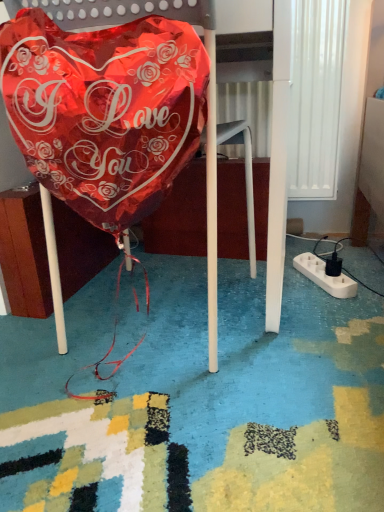
Question: From the image's perspective, is shiny metallic balloon at center below shiny metallic balloon at left?

Choices:
 (A) no
 (B) yes

Answer: (A)

Question: Is shiny metallic balloon at center oriented away from shiny metallic balloon at left?

Choices:
 (A) no
 (B) yes

Answer: (A)

Question: Could you tell me if shiny metallic balloon at center is facing shiny metallic balloon at left?

Choices:
 (A) yes
 (B) no

Answer: (A)

Question: Can you confirm if shiny metallic balloon at center is thinner than shiny metallic balloon at left?

Choices:
 (A) no
 (B) yes

Answer: (A)

Question: From a real-world perspective, does shiny metallic balloon at center sit lower than shiny metallic balloon at left?

Choices:
 (A) no
 (B) yes

Answer: (A)

Question: Considering the positions of point (109, 10) and point (38, 96), is point (109, 10) closer or farther from the camera than point (38, 96)?

Choices:
 (A) closer
 (B) farther

Answer: (B)

Question: Is shiny metallic balloon at center to the left or to the right of shiny metallic balloon at left in the image?

Choices:
 (A) left
 (B) right

Answer: (B)

Question: Relative to shiny metallic balloon at left, is shiny metallic balloon at center in front or behind?

Choices:
 (A) behind
 (B) front

Answer: (A)

Question: Is shiny metallic balloon at center situated inside shiny metallic balloon at left or outside?

Choices:
 (A) outside
 (B) inside

Answer: (A)

Question: Is white plastic extension cord at lower right situated inside shiny metallic balloon at left or outside?

Choices:
 (A) outside
 (B) inside

Answer: (A)

Question: Considering the positions of white plastic extension cord at lower right and shiny metallic balloon at left in the image, is white plastic extension cord at lower right taller or shorter than shiny metallic balloon at left?

Choices:
 (A) tall
 (B) short

Answer: (B)

Question: Relative to shiny metallic balloon at left, is white plastic extension cord at lower right in front or behind?

Choices:
 (A) behind
 (B) front

Answer: (A)

Question: Considering the positions of white plastic extension cord at lower right and shiny metallic balloon at left in the image, is white plastic extension cord at lower right wider or thinner than shiny metallic balloon at left?

Choices:
 (A) thin
 (B) wide

Answer: (B)

Question: Is white plastic extension cord at lower right wider or thinner than shiny metallic balloon at center?

Choices:
 (A) thin
 (B) wide

Answer: (A)

Question: From the image's perspective, is white plastic extension cord at lower right above or below shiny metallic balloon at center?

Choices:
 (A) above
 (B) below

Answer: (B)